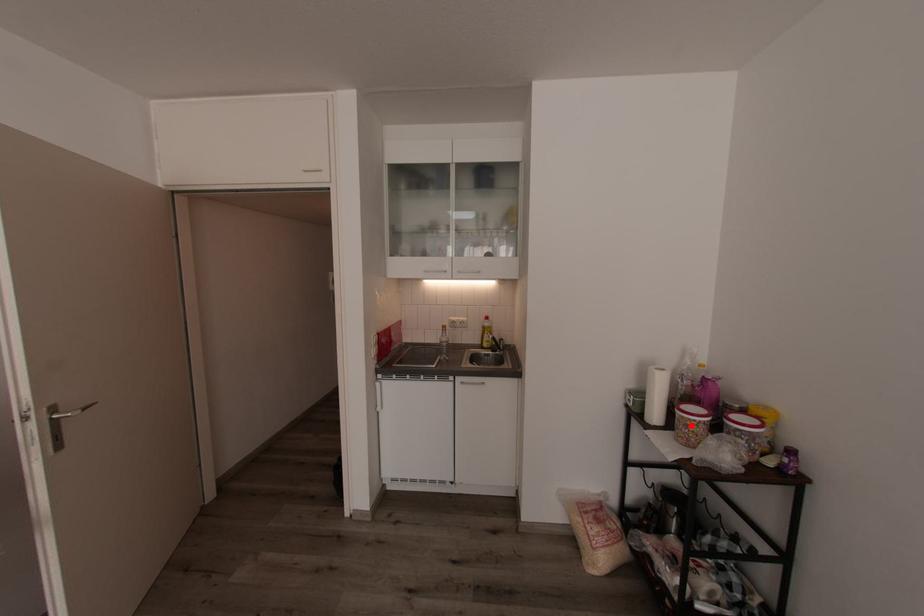
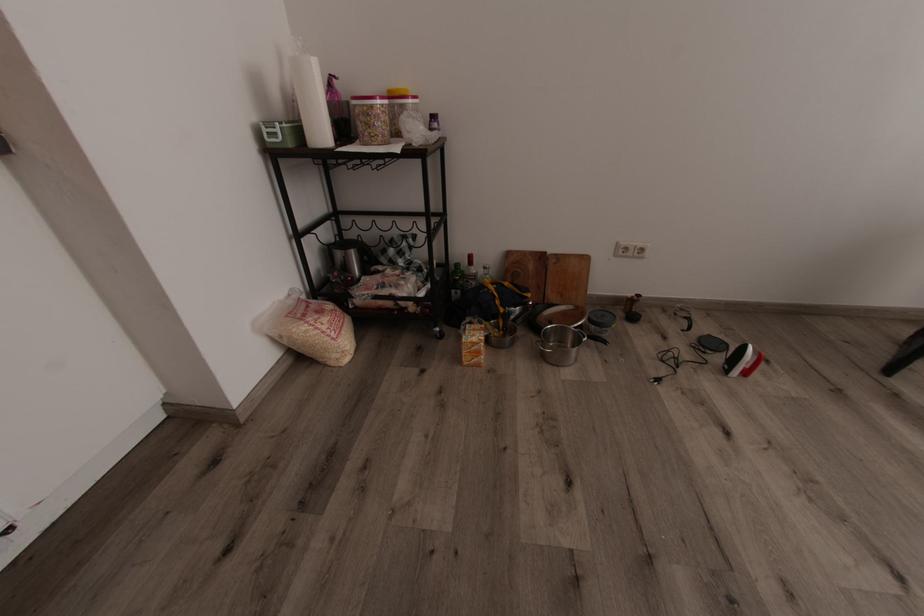
Locate, in the second image, the point that corresponds to the highlighted location in the first image.

(382, 116)